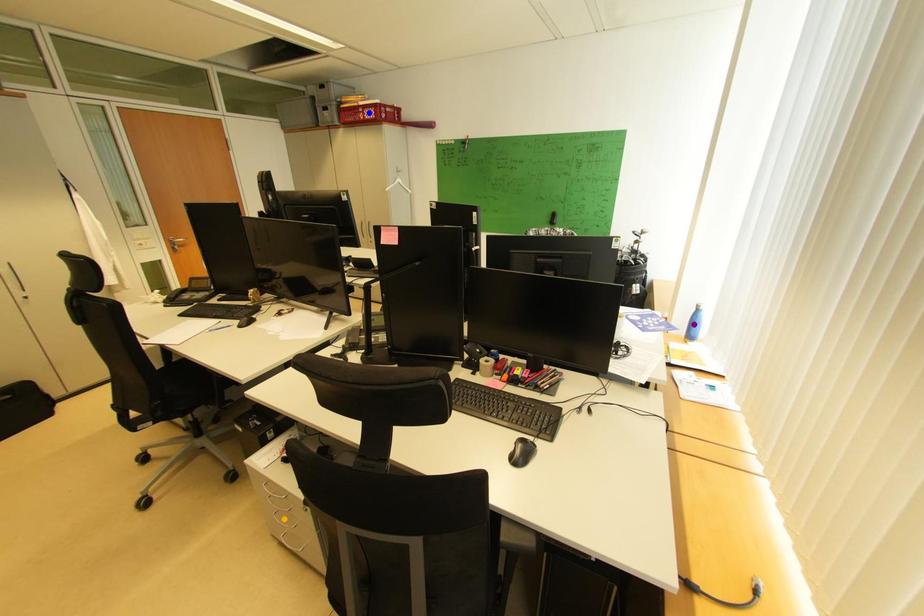
Order these from farthest to nearest:
- blue point
- purple point
- orange point

blue point → purple point → orange point